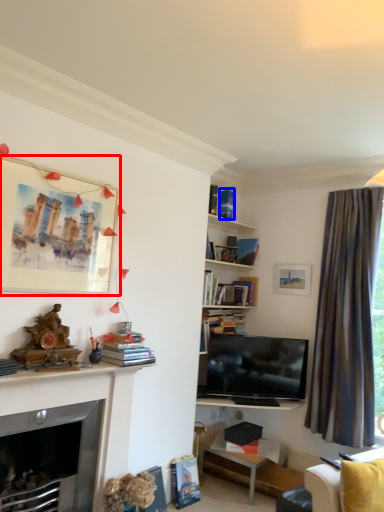
Question: Which of the following is the farthest to the observer, picture frame (highlighted by a red box) or book (highlighted by a blue box)?

Choices:
 (A) picture frame
 (B) book

Answer: (B)